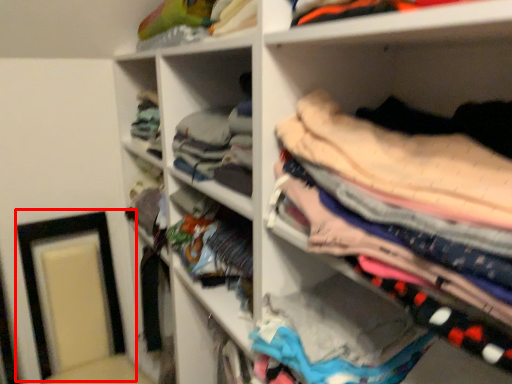
Question: From the image's perspective, where is picture frame (annotated by the red box) located in relation to clothing in the image?

Choices:
 (A) above
 (B) below

Answer: (B)